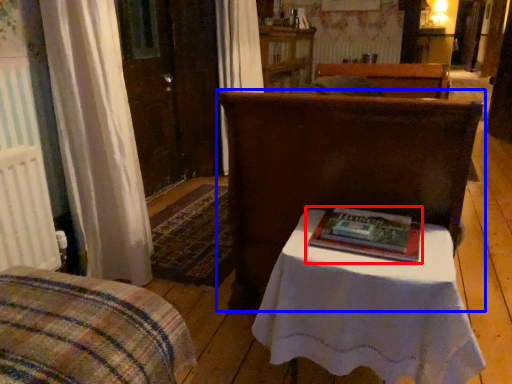
Question: Which object appears farthest to the camera in this image, book (highlighted by a red box) or furniture (highlighted by a blue box)?

Choices:
 (A) book
 (B) furniture

Answer: (A)